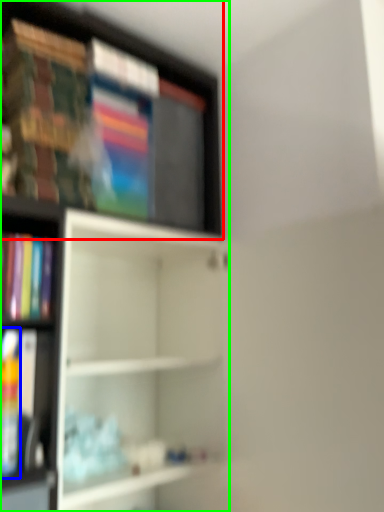
Question: Which is farther away from shelf (highlighted by a red box)? book (highlighted by a blue box) or shelf (highlighted by a green box)?

Choices:
 (A) book
 (B) shelf

Answer: (A)